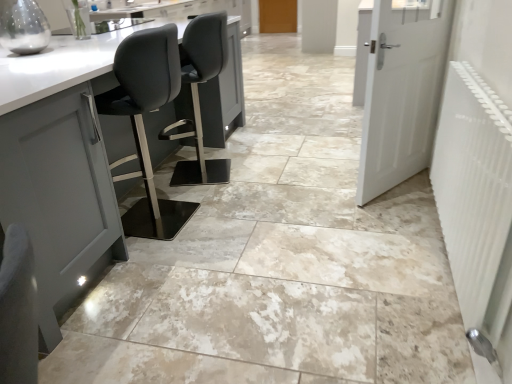
Question: Is white matte door at right, which is the 2th door from top to bottom, shorter than white textured radiator at right?

Choices:
 (A) no
 (B) yes

Answer: (A)

Question: Is white matte door at right, which is the second door in back-to-front order, positioned beyond the bounds of white textured radiator at right?

Choices:
 (A) no
 (B) yes

Answer: (B)

Question: Can you confirm if white matte door at right, placed as the first door when sorted from front to back, is taller than white textured radiator at right?

Choices:
 (A) yes
 (B) no

Answer: (A)

Question: Does white matte door at right, which is the 2th door from top to bottom, appear on the left side of white textured radiator at right?

Choices:
 (A) yes
 (B) no

Answer: (B)

Question: Is white matte door at right, which appears as the first door when ordered from the bottom, further to the viewer compared to white textured radiator at right?

Choices:
 (A) no
 (B) yes

Answer: (B)

Question: Considering their positions, is white textured radiator at right located in front of or behind white matte door at right, which is the second door in back-to-front order?

Choices:
 (A) front
 (B) behind

Answer: (A)

Question: Do you think white textured radiator at right is within white matte door at right, which is the second door in back-to-front order, or outside of it?

Choices:
 (A) outside
 (B) inside

Answer: (A)

Question: Looking at the image, does white textured radiator at right seem bigger or smaller compared to white matte door at right, placed as the first door when sorted from front to back?

Choices:
 (A) small
 (B) big

Answer: (A)

Question: Is point (460, 120) closer or farther from the camera than point (431, 0)?

Choices:
 (A) closer
 (B) farther

Answer: (A)

Question: Looking at the image, does wooden door at center, the 2th door positioned from the bottom, seem bigger or smaller compared to white matte door at right, which appears as the first door when ordered from the bottom?

Choices:
 (A) big
 (B) small

Answer: (B)

Question: Considering their positions, is wooden door at center, which is the second door from front to back, located in front of or behind white matte door at right, which is the 2th door from top to bottom?

Choices:
 (A) behind
 (B) front

Answer: (A)

Question: Is point (263, 26) positioned closer to the camera than point (424, 163)?

Choices:
 (A) closer
 (B) farther

Answer: (B)

Question: From the image's perspective, is wooden door at center, which ranks as the 1th door in top-to-bottom order, located above or below white matte door at right, which is the second door in back-to-front order?

Choices:
 (A) below
 (B) above

Answer: (B)

Question: From a real-world perspective, relative to wooden door at center, which ranks as the 1th door in top-to-bottom order, is white matte door at right, which appears as the first door when ordered from the bottom, vertically above or below?

Choices:
 (A) above
 (B) below

Answer: (A)

Question: Considering the positions of white matte door at right, which is the 2th door from top to bottom, and wooden door at center, which ranks as the 1th door in top-to-bottom order, in the image, is white matte door at right, which is the 2th door from top to bottom, taller or shorter than wooden door at center, which ranks as the 1th door in top-to-bottom order,?

Choices:
 (A) tall
 (B) short

Answer: (A)